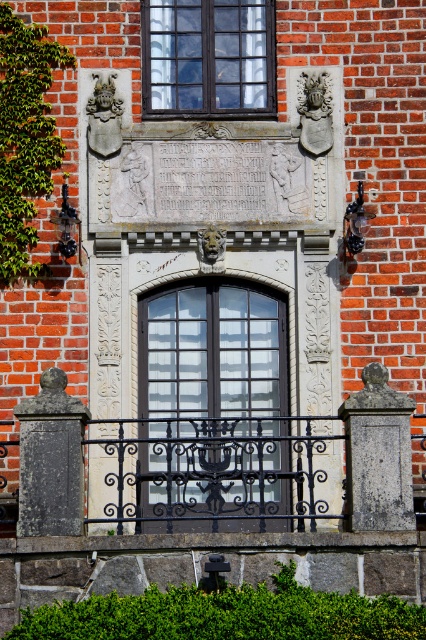
Who is more forward, (249, 627) or (155, 48)?

Positioned in front is point (249, 627).

Is point (23, 637) less distant than point (222, 33)?

Yes, it is.

Locate an element on the screen. green leafy hedge at lower center is located at coordinates (226, 614).

Does matte black window at center appear on the right side of matte black window at upper center?

Indeed, matte black window at center is positioned on the right side of matte black window at upper center.

You are a GUI agent. You are given a task and a screenshot of the screen. Output one action in this format:
    pyautogui.click(x=<x>, y=<y>)
    Task: Click on the matte black window at center
    The height and width of the screenshot is (640, 426).
    Given the screenshot: What is the action you would take?
    pyautogui.click(x=213, y=404)

Image resolution: width=426 pixels, height=640 pixels. In order to click on matte black window at center in this screenshot , I will do point(213,404).

You are a GUI agent. You are given a task and a screenshot of the screen. Output one action in this format:
    pyautogui.click(x=<x>, y=<y>)
    Task: Click on the matte black window at upper center
    This screenshot has width=426, height=640.
    Given the screenshot: What is the action you would take?
    pyautogui.click(x=207, y=58)

Can you confirm if matte black window at upper center is positioned above green leafy ivy at left?

Correct, matte black window at upper center is located above green leafy ivy at left.

Who is more forward, (161,52) or (0,228)?

Point (0,228) is in front.

Locate an element on the screen. matte black window at upper center is located at coordinates [207, 58].